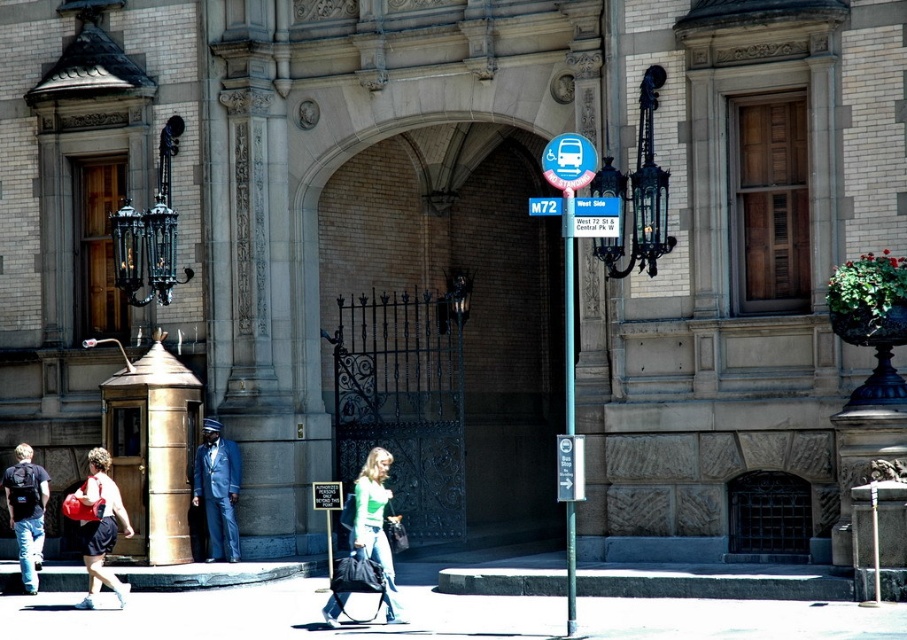
Question: Where is green jersey at center located in relation to matte red bucket at lower left in the image?

Choices:
 (A) left
 (B) right

Answer: (B)

Question: Which point appears closest to the camera in this image?

Choices:
 (A) (113, 513)
 (B) (28, 497)
 (C) (571, 401)
 (D) (211, 541)

Answer: (A)

Question: Which object is closer to the camera taking this photo?

Choices:
 (A) gold polished pillar at left
 (B) smooth concrete pavement at lower center

Answer: (B)

Question: Observing the image, what is the correct spatial positioning of blue fabric suit at center in reference to matte red bucket at lower left?

Choices:
 (A) below
 (B) above

Answer: (B)

Question: Does blue fabric suit at center appear on the left side of metallic pole at center?

Choices:
 (A) yes
 (B) no

Answer: (A)

Question: Which of the following is the farthest from the observer?

Choices:
 (A) (551, 166)
 (B) (571, 388)

Answer: (B)